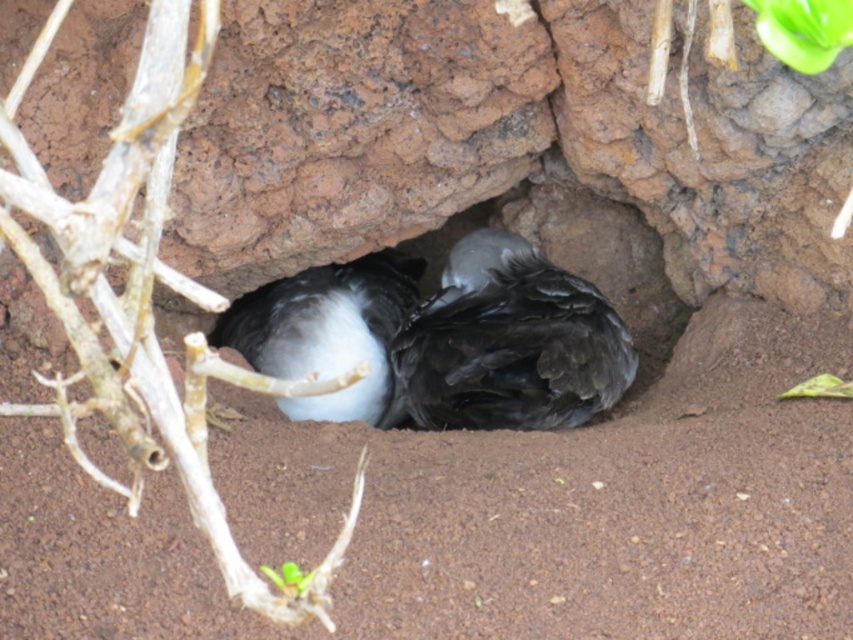
You are standing 30 inches away from a rocky surface. There is a point marked at coordinates point (45, 186). Can you reach that point without moving closer than your current distance?

The distance of point (45, 186) from viewer is 28.83 inches, which is closer than your current 30 inches distance. Therefore, you cannot reach the point without moving closer.

You are a bird looking for a place to rest. You see a brown woody branch at left and a smooth rock hole at center. Which one is taller?

The brown woody branch at left is taller than the smooth rock hole at center.